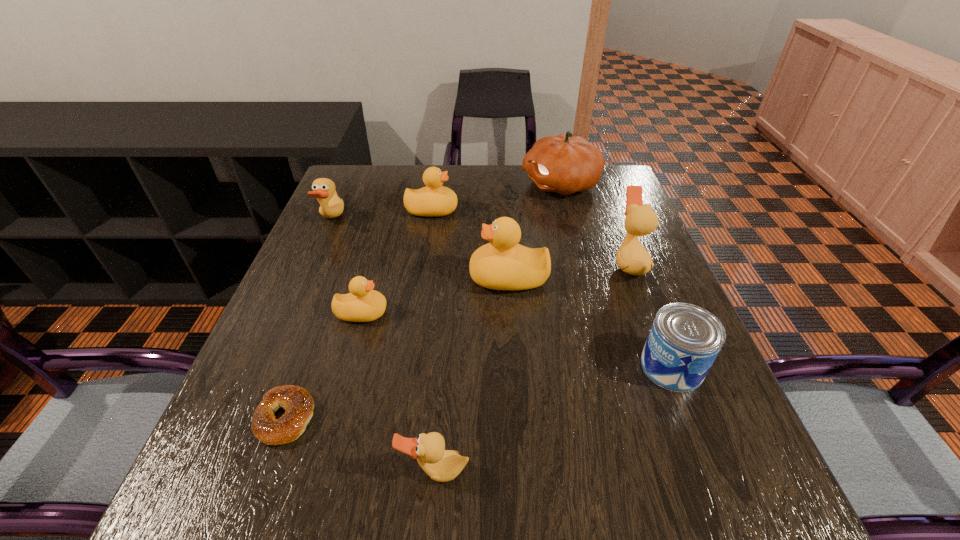
Locate an element on the screen. This screenshot has height=540, width=960. pumpkin is located at coordinates (563, 164).

Locate an element on the screen. This screenshot has height=540, width=960. the rightmost yellow duck is located at coordinates (503, 264).

Identify the location of the second nearest yellow duck. (503, 264).

Identify the location of the rightmost tan duck. (632, 258).

You are a GUI agent. You are given a task and a screenshot of the screen. Output one action in this format:
    pyautogui.click(x=<x>, y=<y>)
    Task: Click on the rightmost duck
    This screenshot has height=540, width=960.
    Given the screenshot: What is the action you would take?
    pyautogui.click(x=632, y=258)

Find the location of a particular element. The width and height of the screenshot is (960, 540). the farthest yellow duck is located at coordinates (434, 200).

Identify the location of the leftmost duck. The height and width of the screenshot is (540, 960). (332, 206).

Find the location of a particular element. The image size is (960, 540). the farthest tan duck is located at coordinates (332, 206).

The height and width of the screenshot is (540, 960). I want to click on blue can, so click(684, 341).

This screenshot has width=960, height=540. Find the location of `the nearest yellow duck`. the nearest yellow duck is located at coordinates (363, 304).